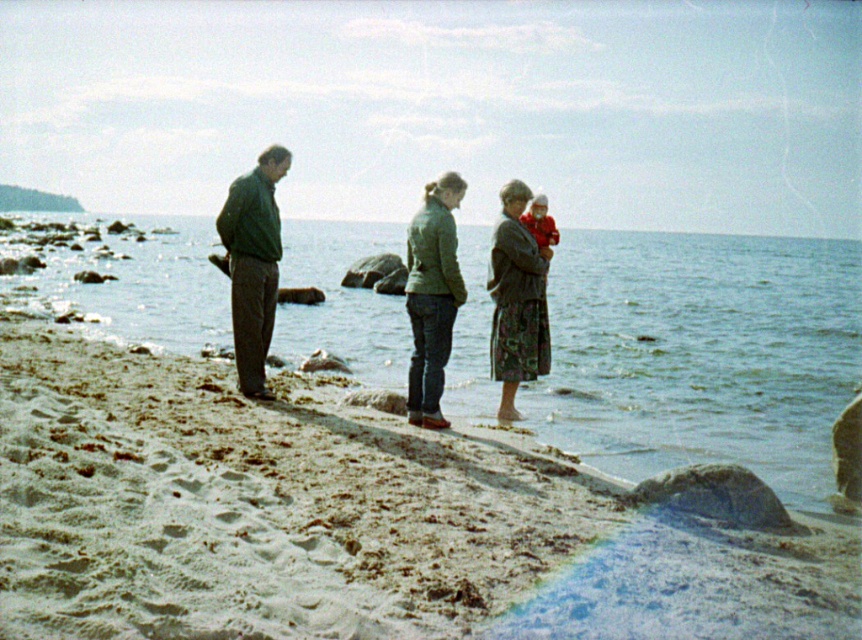
You are standing on the beach and want to take a photo that includes both the point at coordinates (x=614, y=564) and the point at coordinates (x=545, y=307). Which point should you focus on first to ensure both are in focus?

You should focus on point (x=614, y=564) first because it is closer to the camera than point (x=545, y=307), ensuring both will be in focus when using depth of field.

You are a photographer standing on the beach and want to capture a shot of the clear water at lower left and the green matte jacket at center. Based on their positions, can you tell which object is closer to the camera?

The clear water at lower left is positioned over the green matte jacket at center, meaning it is closer to the camera.

You are planning to place a small picnic basket on the sandy beach at lower left and the floral skirt at center. Which location has enough space to accommodate the basket without overlapping?

The sandy beach at lower left is larger in size than the floral skirt at center, so it has enough space to accommodate the picnic basket without overlapping.